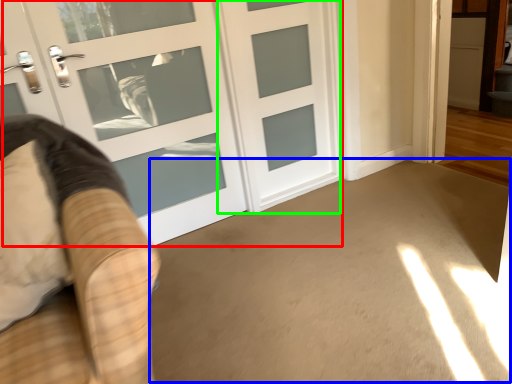
Question: Which is nearer to the door (highlighted by a red box)? corridor (highlighted by a blue box) or door (highlighted by a green box).

Choices:
 (A) corridor
 (B) door

Answer: (B)